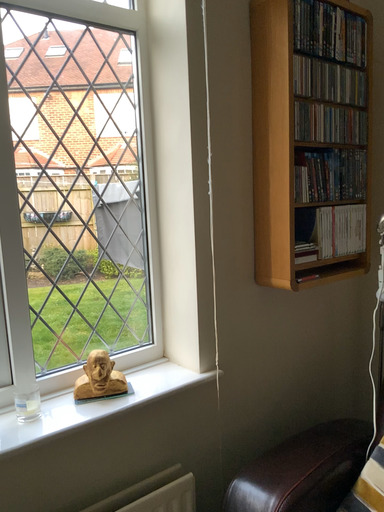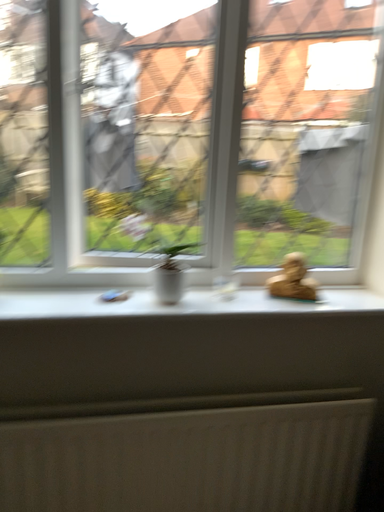
Question: Which way did the camera rotate in the video?

Choices:
 (A) rotated right
 (B) rotated left

Answer: (B)